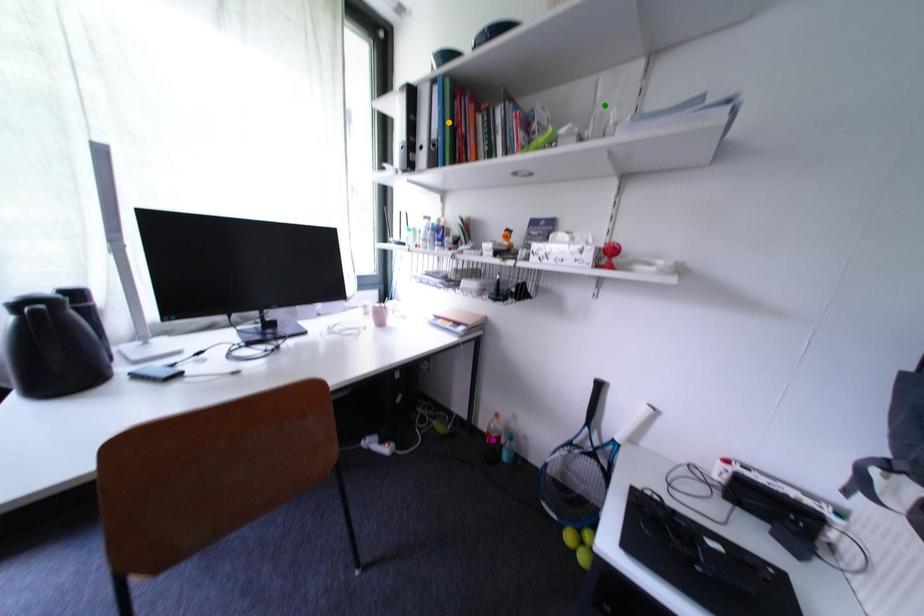
Order these from nearest to farthest:
green point, orange point, purple point

purple point, orange point, green point